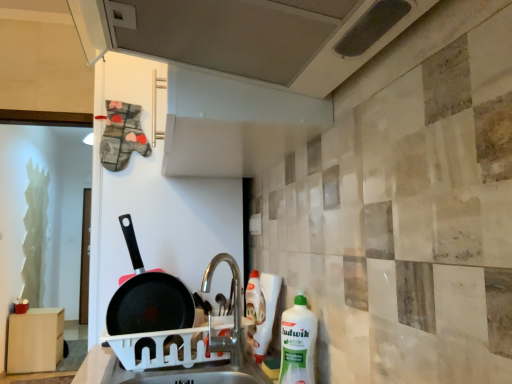
Question: Is white plastic sink at center positioned behind metallic perforated exhaust hood at upper center?

Choices:
 (A) yes
 (B) no

Answer: (A)

Question: From a real-world perspective, is white plastic sink at center physically above metallic perforated exhaust hood at upper center?

Choices:
 (A) no
 (B) yes

Answer: (A)

Question: Is white plastic sink at center with metallic perforated exhaust hood at upper center?

Choices:
 (A) yes
 (B) no

Answer: (B)

Question: Is white plastic sink at center at the right side of metallic perforated exhaust hood at upper center?

Choices:
 (A) yes
 (B) no

Answer: (B)

Question: Considering the relative sizes of white plastic sink at center and metallic perforated exhaust hood at upper center in the image provided, is white plastic sink at center smaller than metallic perforated exhaust hood at upper center?

Choices:
 (A) yes
 (B) no

Answer: (A)

Question: Based on their sizes in the image, would you say black non-stick frying pan at center is bigger or smaller than white plastic bottle at right?

Choices:
 (A) small
 (B) big

Answer: (B)

Question: From the image's perspective, is black non-stick frying pan at center located above or below white plastic bottle at right?

Choices:
 (A) above
 (B) below

Answer: (A)

Question: Looking at their shapes, would you say black non-stick frying pan at center is wider or thinner than white plastic bottle at right?

Choices:
 (A) wide
 (B) thin

Answer: (B)

Question: Is point (173, 306) positioned closer to the camera than point (293, 324)?

Choices:
 (A) farther
 (B) closer

Answer: (A)

Question: From a real-world perspective, relative to silver metallic tap at center, is black non-stick frying pan at center vertically above or below?

Choices:
 (A) below
 (B) above

Answer: (B)

Question: In the image, is black non-stick frying pan at center positioned in front of or behind silver metallic tap at center?

Choices:
 (A) behind
 (B) front

Answer: (A)

Question: Does point (130, 317) appear closer or farther from the camera than point (236, 296)?

Choices:
 (A) farther
 (B) closer

Answer: (B)

Question: Considering the positions of black non-stick frying pan at center and silver metallic tap at center in the image, is black non-stick frying pan at center wider or thinner than silver metallic tap at center?

Choices:
 (A) wide
 (B) thin

Answer: (B)

Question: Based on their positions, is white plastic dish rack at sink located to the left or right of white plastic sink at center?

Choices:
 (A) right
 (B) left

Answer: (A)

Question: Does point (202, 374) appear closer or farther from the camera than point (202, 382)?

Choices:
 (A) farther
 (B) closer

Answer: (A)